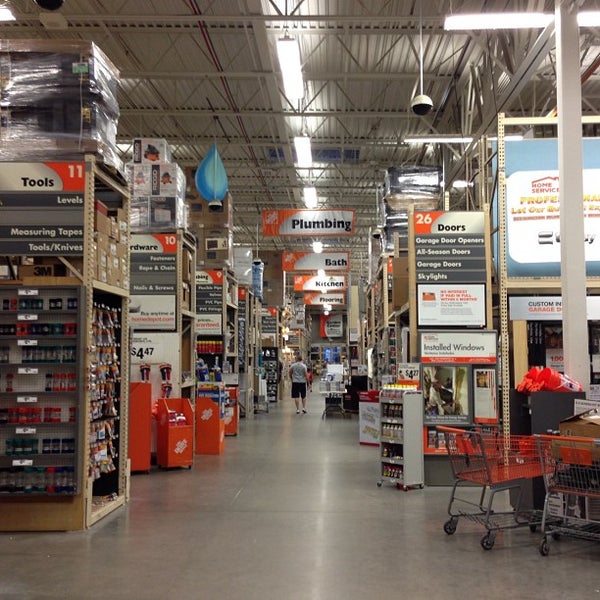
Locate an element on the screen. This screenshot has height=600, width=600. basket is located at coordinates (513, 470), (578, 490).